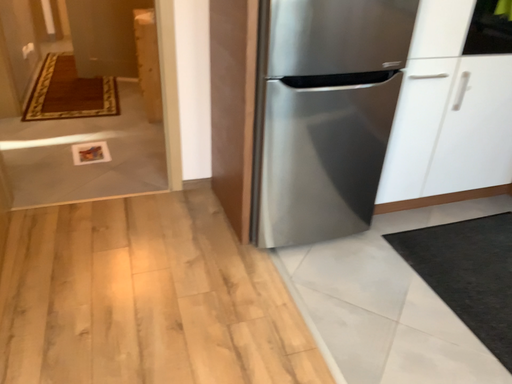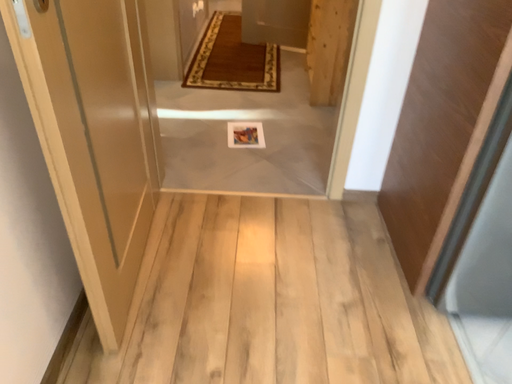
Question: Which way did the camera rotate in the video?

Choices:
 (A) rotated left
 (B) rotated right

Answer: (A)